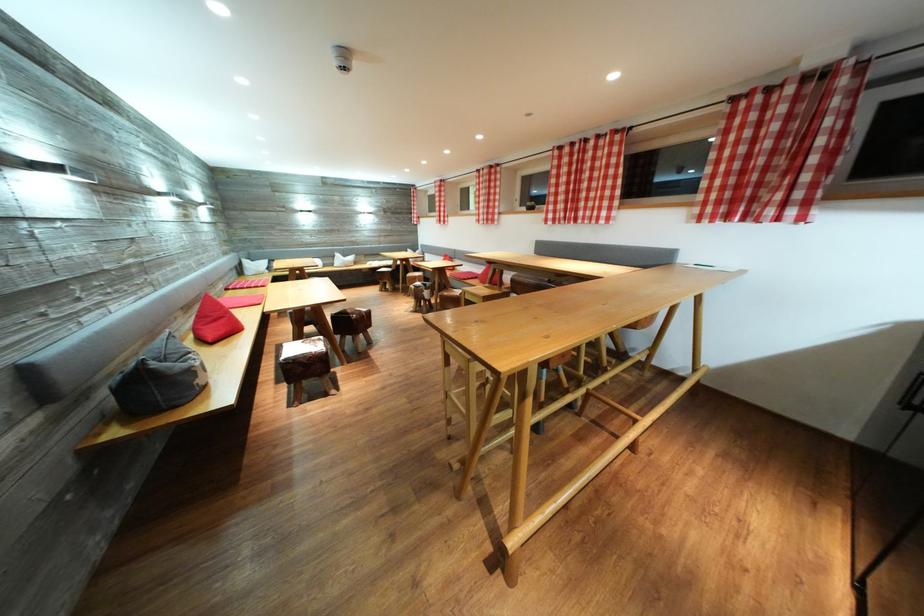
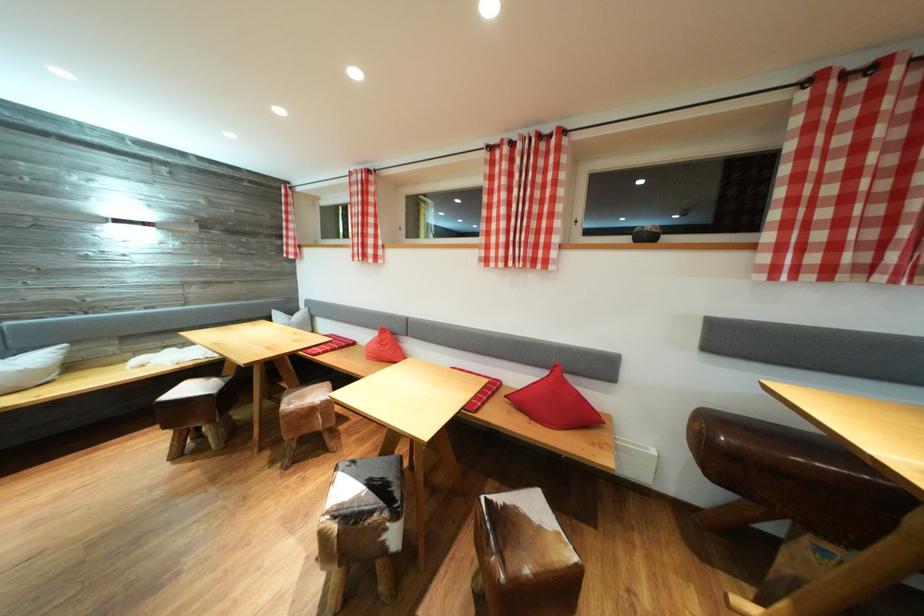
Find the pixel in the second image that matches point (351, 261) in the first image.

(14, 358)